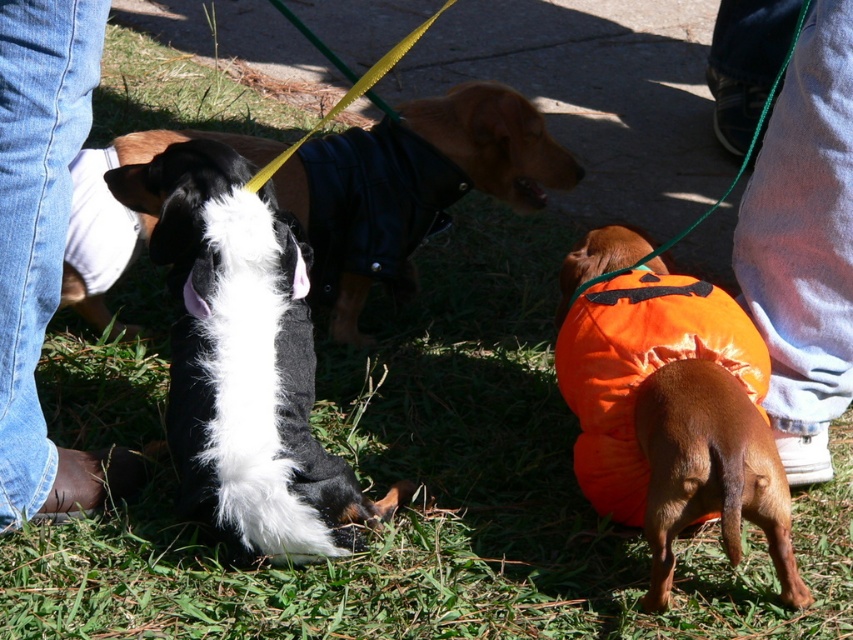
Question: Which point is closer to the camera?

Choices:
 (A) denim pants at lower right
 (B) black and white fur at center
 (C) orange fabric dog at center

Answer: (C)

Question: Estimate the real-world distances between objects in this image. Which object is farther from the black leather jacket at center?

Choices:
 (A) black and white fur at center
 (B) orange fabric dog at lower right
 (C) orange fabric dog at center
 (D) denim pants at lower right

Answer: (B)

Question: Is denim pants at lower right to the right of orange fabric dog at center from the viewer's perspective?

Choices:
 (A) no
 (B) yes

Answer: (B)

Question: Does black leather jacket at center appear on the right side of orange fabric dog at lower right?

Choices:
 (A) no
 (B) yes

Answer: (A)

Question: Where is black leather jacket at center located in relation to jeans at lower left in the image?

Choices:
 (A) above
 (B) below

Answer: (A)

Question: Which point is closer to the camera?

Choices:
 (A) (776, 128)
 (B) (474, 188)
 (C) (682, 490)
 (D) (274, 266)

Answer: (C)